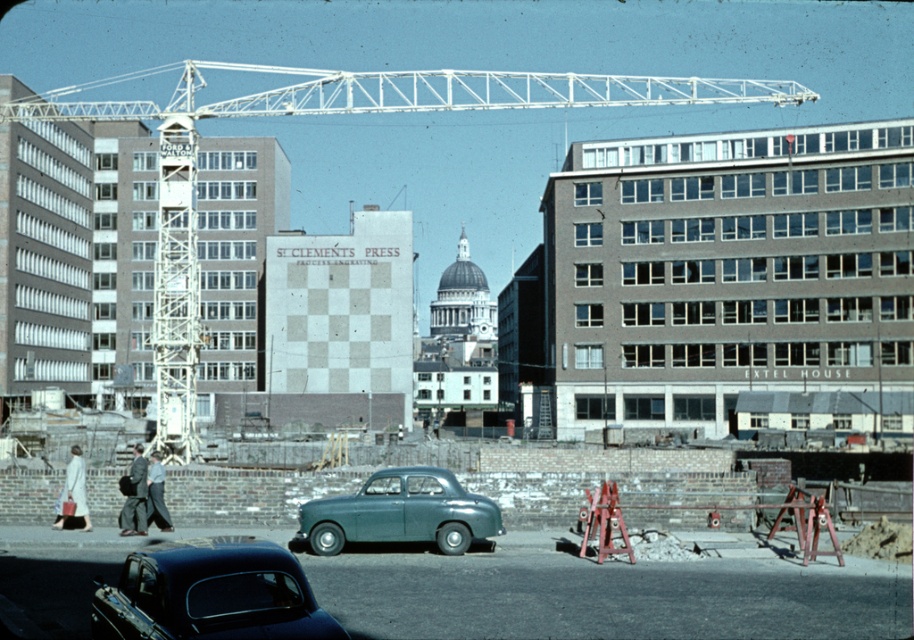
Question: Estimate the real-world distances between objects in this image. Which object is farther from the shiny black car at center?

Choices:
 (A) dark gray suit at center
 (B) gray brick building at center
 (C) teal matte sedan at center

Answer: (B)

Question: Is gray brick building at center smaller than white metal crane at upper center?

Choices:
 (A) yes
 (B) no

Answer: (A)

Question: Which point is closer to the camera?

Choices:
 (A) light blue fabric construction worker at lower left
 (B) white metal crane at upper center

Answer: (A)

Question: Which of the following is the farthest from the observer?

Choices:
 (A) white metal crane at upper center
 (B) teal matte sedan at center
 (C) shiny black car at center
 (D) light blue fabric construction worker at lower left

Answer: (A)

Question: Is white metal crane at upper center smaller than shiny black car at center?

Choices:
 (A) yes
 (B) no

Answer: (B)

Question: Is teal matte sedan at center smaller than dark gray suit at center?

Choices:
 (A) no
 (B) yes

Answer: (B)